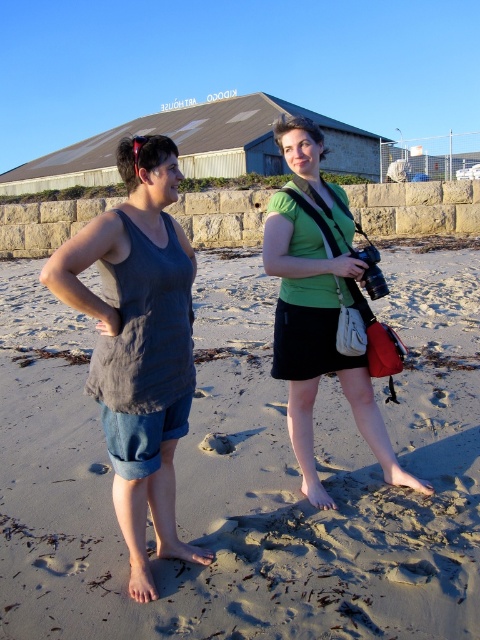
Question: Is sandy beach at center above denim shorts at left?

Choices:
 (A) yes
 (B) no

Answer: (B)

Question: Which of the following is the closest to the observer?

Choices:
 (A) sandy beach at center
 (B) green matte shirt at center
 (C) denim shorts at left

Answer: (C)

Question: Which object appears farthest from the camera in this image?

Choices:
 (A) sandy beach at center
 (B) denim shorts at left

Answer: (A)

Question: Where is sandy beach at center located in relation to denim shorts at left in the image?

Choices:
 (A) above
 (B) below

Answer: (B)

Question: Does sandy beach at center come behind denim shorts at left?

Choices:
 (A) yes
 (B) no

Answer: (A)

Question: Which object is farther from the camera taking this photo?

Choices:
 (A) green matte shirt at center
 (B) sandy beach at center

Answer: (A)